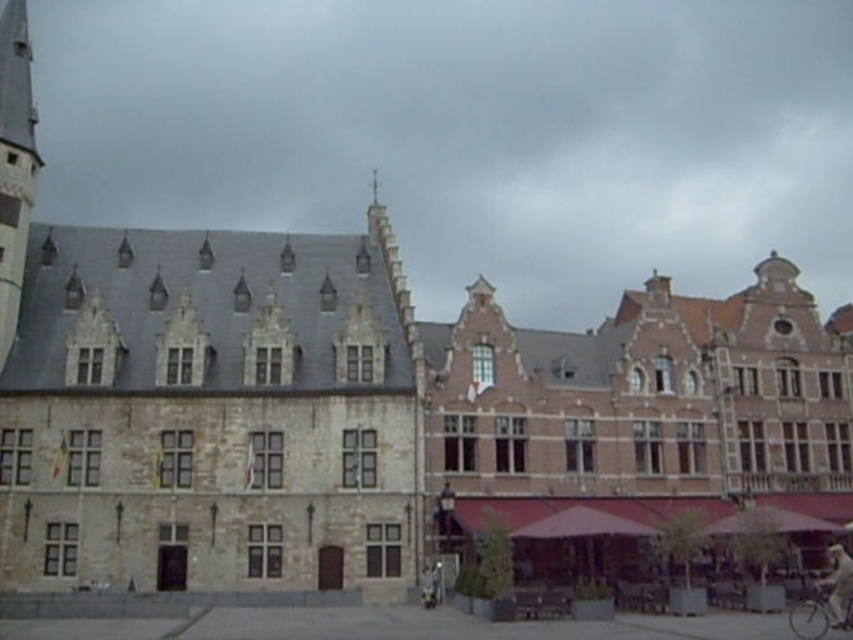
You are standing in front of the historic building complex and want to determine the spatial relationship between the two points marked on the image. Which point is closer to you, point (834, 593) or point (839, 592)?

Point (839, 592) is closer to you because the Objects Description states that point (834, 593) is behind point (839, 592).

You are a delivery person who needs to pick up a package from the lower right corner of the image. There is a silver metallic bicycle at lower right and a white cotton shirt at lower right in your way. Which object is closer to you as you approach from the front of the image?

The silver metallic bicycle at lower right is positioned under the white cotton shirt at lower right, so the white cotton shirt at lower right is closer to you.

You are standing at the entrance of the historic building complex and notice a silver metallic bicycle at lower right and a white cotton shirt at lower right. Which object is closer to the left side of the scene?

The silver metallic bicycle at lower right is closer to the left side of the scene because it is positioned to the left of the white cotton shirt at lower right.